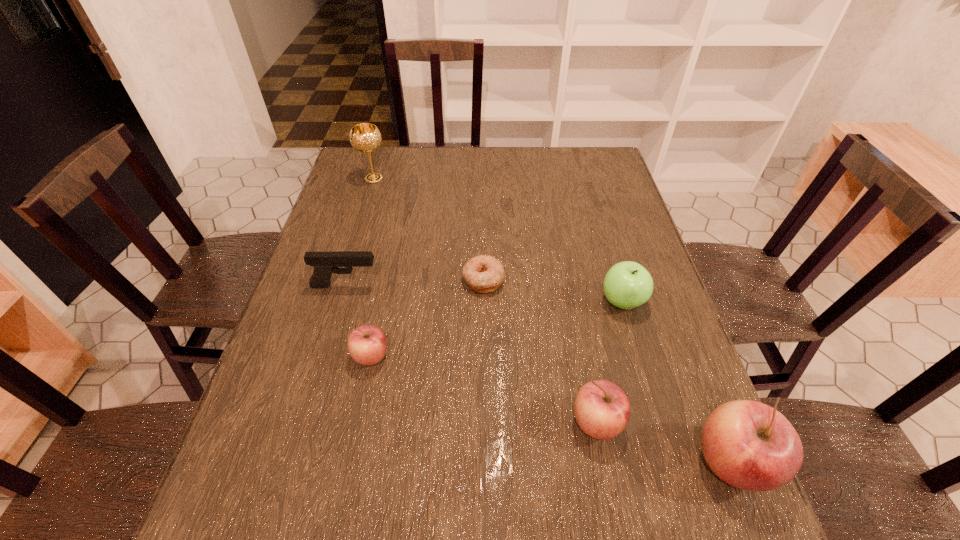
Identify the location of empty space between the farthest object and the farthest apple. pyautogui.click(x=498, y=240).

In order to click on unoccupied area between the pistol and the farthest apple in this screenshot , I will do `click(484, 294)`.

Image resolution: width=960 pixels, height=540 pixels. Identify the location of free area in between the leftmost apple and the shortest object. (427, 318).

The width and height of the screenshot is (960, 540). Find the location of `empty space that is in between the fifth object from left to right and the tallest apple`. empty space that is in between the fifth object from left to right and the tallest apple is located at coordinates (663, 443).

This screenshot has width=960, height=540. What are the coordinates of `empty space between the shortest apple and the pistol` in the screenshot? It's located at (358, 321).

This screenshot has height=540, width=960. Find the location of `free space between the third apple from right to left and the farthest object`. free space between the third apple from right to left and the farthest object is located at coordinates (485, 301).

Image resolution: width=960 pixels, height=540 pixels. I want to click on empty space that is in between the tallest apple and the farthest object, so click(552, 321).

Locate which object is the sixth closest to the pistol. Please provide its 2D coordinates. Your answer should be formatted as a tuple, i.e. [(x, y)], where the tuple contains the x and y coordinates of a point satisfying the conditions above.

[(749, 445)]

Locate which object ranks sixth in proximity to the farthest apple. Please provide its 2D coordinates. Your answer should be formatted as a tuple, i.e. [(x, y)], where the tuple contains the x and y coordinates of a point satisfying the conditions above.

[(365, 137)]

At what (x,y) coordinates should I click in order to perform the action: click on the closest apple to the pistol. Please return your answer as a coordinate pair (x, y). Looking at the image, I should click on (367, 344).